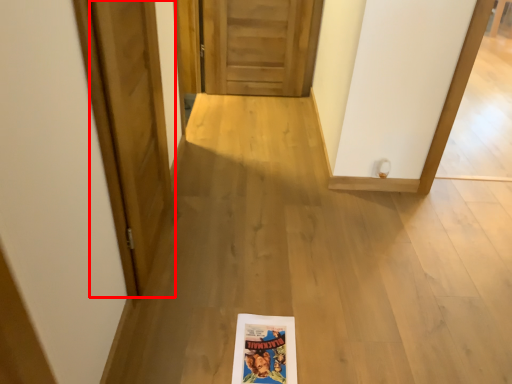
Question: From the image's perspective, where is door (annotated by the red box) located in relation to door in the image?

Choices:
 (A) above
 (B) below

Answer: (B)